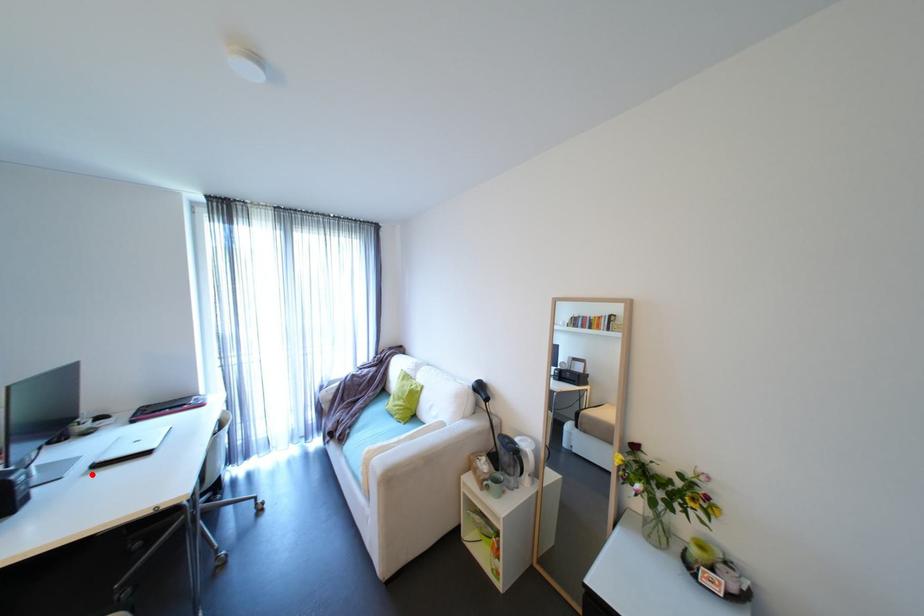
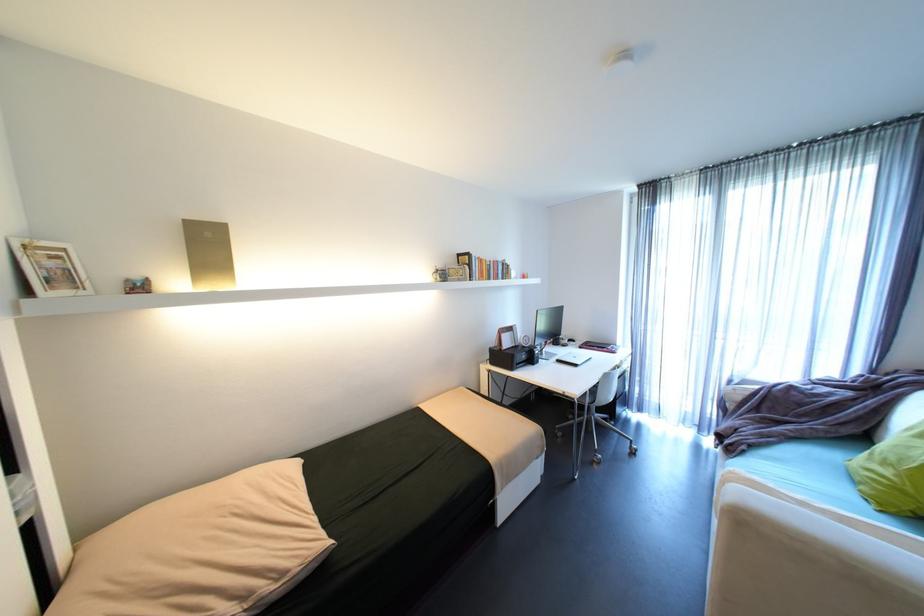
Locate, in the second image, the point that corresponds to the highlighted location in the first image.

(562, 363)